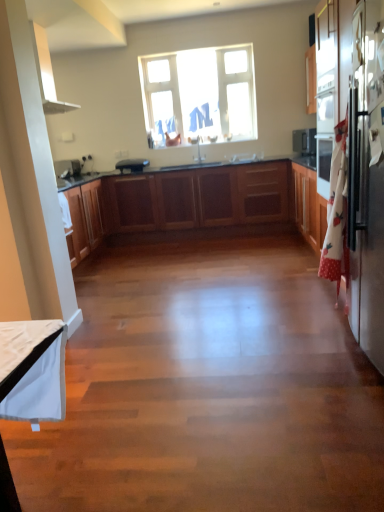
Question: Considering the positions of clear glass window at upper center and wooden cabinets at center in the image, is clear glass window at upper center wider or thinner than wooden cabinets at center?

Choices:
 (A) wide
 (B) thin

Answer: (B)

Question: Considering the positions of clear glass window at upper center and wooden cabinets at center in the image, is clear glass window at upper center bigger or smaller than wooden cabinets at center?

Choices:
 (A) big
 (B) small

Answer: (B)

Question: Which object is the farthest from the sleek stainless steel refrigerator at right?

Choices:
 (A) white matte exhaust hood at upper left
 (B) clear glass window at upper center
 (C) black matte toaster at center
 (D) wooden cabinets at center
 (E) white glossy sink at center

Answer: (C)

Question: Which object is positioned closest to the black matte toaster at center?

Choices:
 (A) white matte exhaust hood at upper left
 (B) clear glass window at upper center
 (C) wooden cabinets at center
 (D) white glossy sink at center
 (E) sleek stainless steel refrigerator at right

Answer: (C)